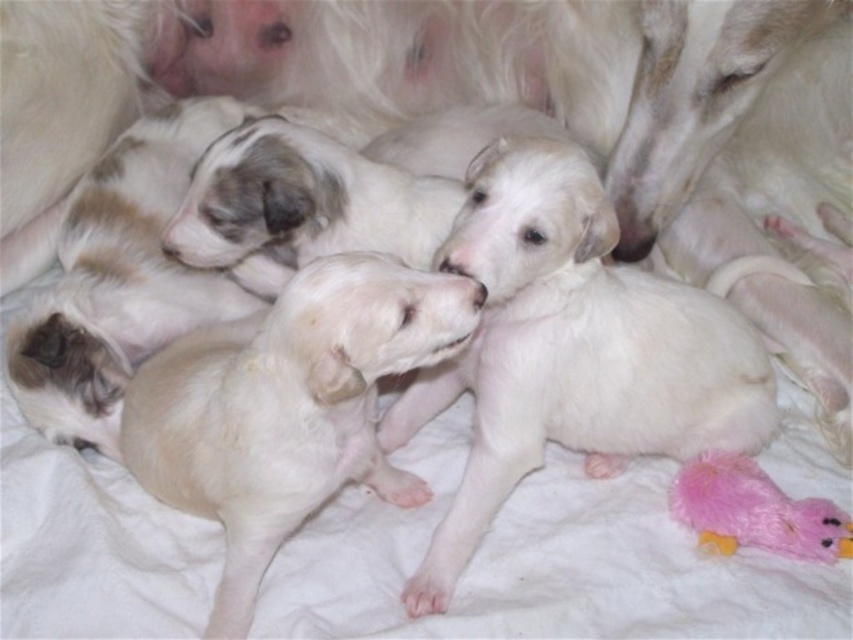
Question: Is white fluffy puppy at center to the left of white soft fur puppy at center from the viewer's perspective?

Choices:
 (A) no
 (B) yes

Answer: (A)

Question: Among these points, which one is nearest to the camera?

Choices:
 (A) (350, 346)
 (B) (711, 538)

Answer: (A)

Question: Can you confirm if white soft fur puppy at center is bigger than fuzzy pink plush at lower right?

Choices:
 (A) no
 (B) yes

Answer: (B)

Question: Does white fluffy puppy at center appear over white soft fur puppy at center?

Choices:
 (A) no
 (B) yes

Answer: (B)

Question: Which point is farther to the camera?

Choices:
 (A) white soft fur puppy at center
 (B) white fluffy puppy at center

Answer: (B)

Question: Which point appears closest to the camera in this image?

Choices:
 (A) (489, 282)
 (B) (438, 284)

Answer: (B)